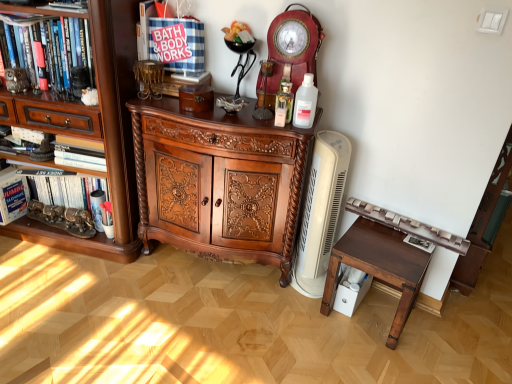
Question: Considering the positions of dark wood carved cabinet at center and brown wood cabinet at left in the image, is dark wood carved cabinet at center taller or shorter than brown wood cabinet at left?

Choices:
 (A) short
 (B) tall

Answer: (A)

Question: From a real-world perspective, is dark wood carved cabinet at center above or below brown wood cabinet at left?

Choices:
 (A) below
 (B) above

Answer: (A)

Question: Based on their relative distances, which object is nearer to the dark brown wooden table at right?

Choices:
 (A) clear plastic bottle at center
 (B) white cardboard box at left, which is the 1th book from left to right
 (C) white plastic heater at right
 (D) hardcover book at left, the 1th book when ordered from right to left
 (E) metallic owl at left

Answer: (C)

Question: Estimate the real-world distances between objects in this image. Which object is farther from the metallic owl at left?

Choices:
 (A) white cardboard box at left, acting as the 2th book starting from the right
 (B) white plastic heater at right
 (C) matte red wooden clock at upper center
 (D) dark brown wooden table at right
 (E) dark wood carved cabinet at center

Answer: (D)